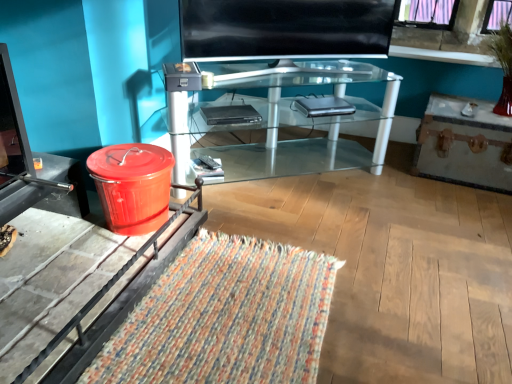
I want to click on free spot below woven multicolored mat at lower left (from a real-world perspective), so click(229, 325).